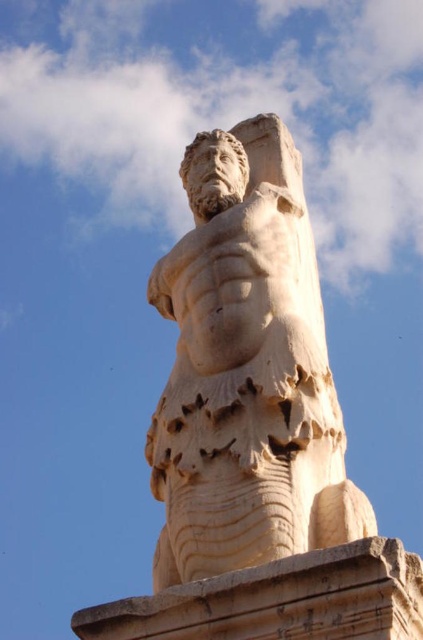
Between point (206, 548) and point (381, 552), which one is positioned in front?

Point (381, 552) is more forward.

Who is more distant from viewer, (208, 259) or (216, 604)?

Point (208, 259)

What do you see at coordinates (247, 371) in the screenshot?
I see `white marble statue at center` at bounding box center [247, 371].

At what (x,y) coordinates should I click in order to perform the action: click on white marble statue at center. Please return your answer as a coordinate pair (x, y). The height and width of the screenshot is (640, 423). Looking at the image, I should click on (247, 371).